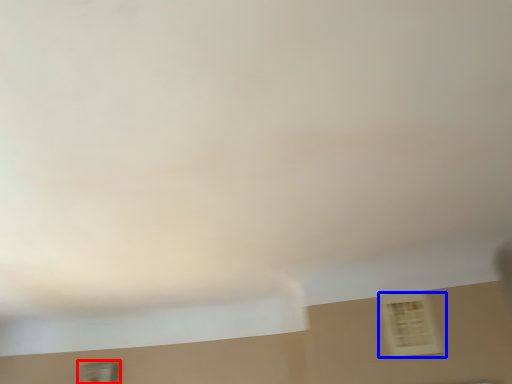
Question: Which object is closer to the camera taking this photo, window (highlighted by a red box) or window (highlighted by a blue box)?

Choices:
 (A) window
 (B) window

Answer: (B)